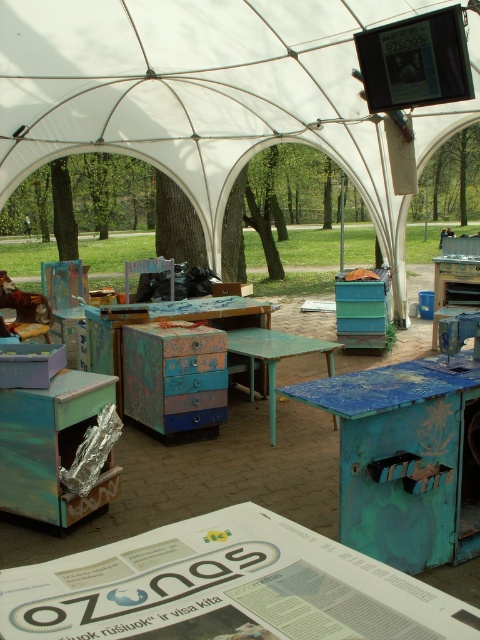
You are a visitor at the event and want to place a 10 feet long banner between the white fabric canopy at center and the blue painted wood table at center. Is there enough space between them to place the banner without folding it?

The white fabric canopy at center is 14.82 feet from the blue painted wood table at center. Since the banner is 10 feet long, there is sufficient space to place it between them without folding.

You are setting up a picnic under the large white tent and want to place a blanket under the white fabric canopy at center. However, there is already a teal painted wood table at center there. Can the table be moved to another location within the tent to make space for your picnic blanket?

The white fabric canopy at center is positioned over the teal painted wood table at center, so the table cannot be moved without also moving the canopy. Since the canopy is likely anchored or part of the tent structure, it might not be easily repositioned, making it difficult to move the table for your picnic blanket.